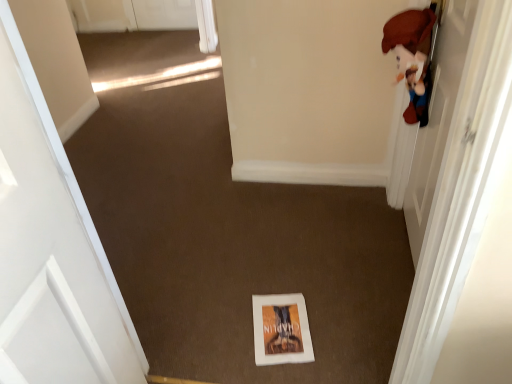
Where is `vacant space that is in between white glossy door at upper right, which is counted as the first door, starting from the right, and white paper book at center`? The width and height of the screenshot is (512, 384). vacant space that is in between white glossy door at upper right, which is counted as the first door, starting from the right, and white paper book at center is located at coordinates (349, 280).